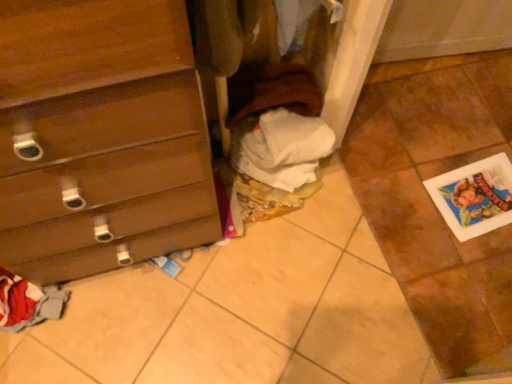
Question: Can you confirm if white paper at lower right is shorter than brown cotton sweater at center?

Choices:
 (A) no
 (B) yes

Answer: (B)

Question: Is white paper at lower right positioned beyond the bounds of brown cotton sweater at center?

Choices:
 (A) no
 (B) yes

Answer: (B)

Question: From a real-world perspective, does white paper at lower right sit lower than brown cotton sweater at center?

Choices:
 (A) no
 (B) yes

Answer: (B)

Question: Is white paper at lower right closer to camera compared to brown cotton sweater at center?

Choices:
 (A) yes
 (B) no

Answer: (B)

Question: Does white paper at lower right have a lesser width compared to brown cotton sweater at center?

Choices:
 (A) yes
 (B) no

Answer: (B)

Question: Is white paper at lower right not near brown cotton sweater at center?

Choices:
 (A) no
 (B) yes

Answer: (A)

Question: Is wooden chest of drawers at left touching brown cotton sweater at center?

Choices:
 (A) yes
 (B) no

Answer: (B)

Question: Can you confirm if wooden chest of drawers at left is shorter than brown cotton sweater at center?

Choices:
 (A) no
 (B) yes

Answer: (A)

Question: Is wooden chest of drawers at left completely or partially outside of brown cotton sweater at center?

Choices:
 (A) no
 (B) yes

Answer: (B)

Question: Is wooden chest of drawers at left taller than brown cotton sweater at center?

Choices:
 (A) yes
 (B) no

Answer: (A)

Question: Is there a large distance between wooden chest of drawers at left and brown cotton sweater at center?

Choices:
 (A) no
 (B) yes

Answer: (A)

Question: Is wooden chest of drawers at left surrounding brown cotton sweater at center?

Choices:
 (A) yes
 (B) no

Answer: (B)

Question: Can you confirm if brown cotton sweater at center is positioned to the left of white paper at lower right?

Choices:
 (A) yes
 (B) no

Answer: (A)